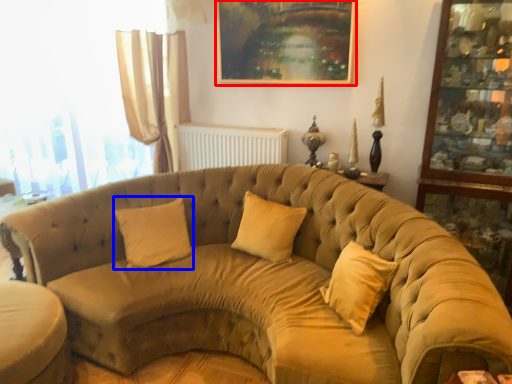
Question: Among these objects, which one is farthest to the camera, picture frame (highlighted by a red box) or pillow (highlighted by a blue box)?

Choices:
 (A) picture frame
 (B) pillow

Answer: (A)